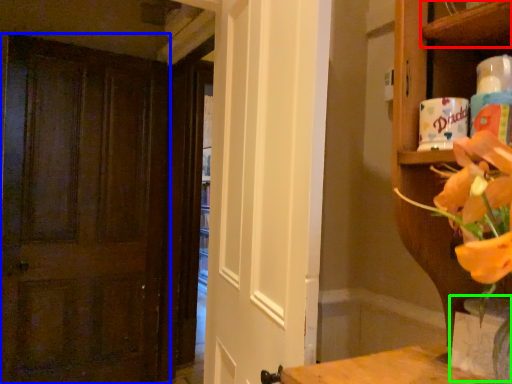
Question: Considering the real-world distances, which object is closest to shelf (highlighted by a red box)? door (highlighted by a blue box) or vase (highlighted by a green box).

Choices:
 (A) door
 (B) vase

Answer: (B)